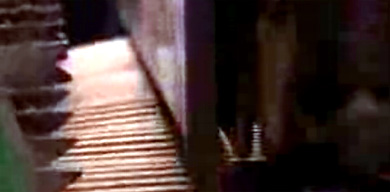
Locate an element on the screen. The image size is (390, 192). support beam is located at coordinates (225, 147).